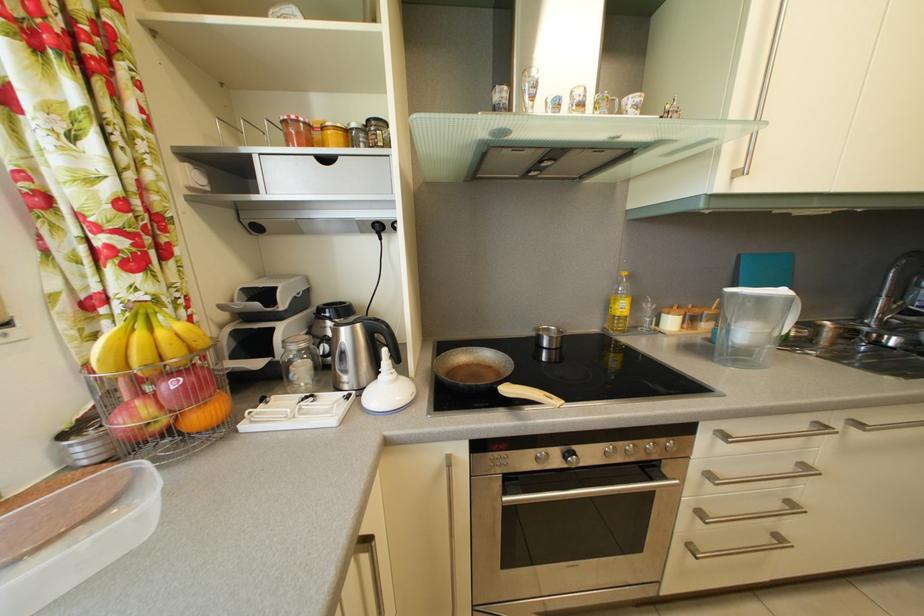
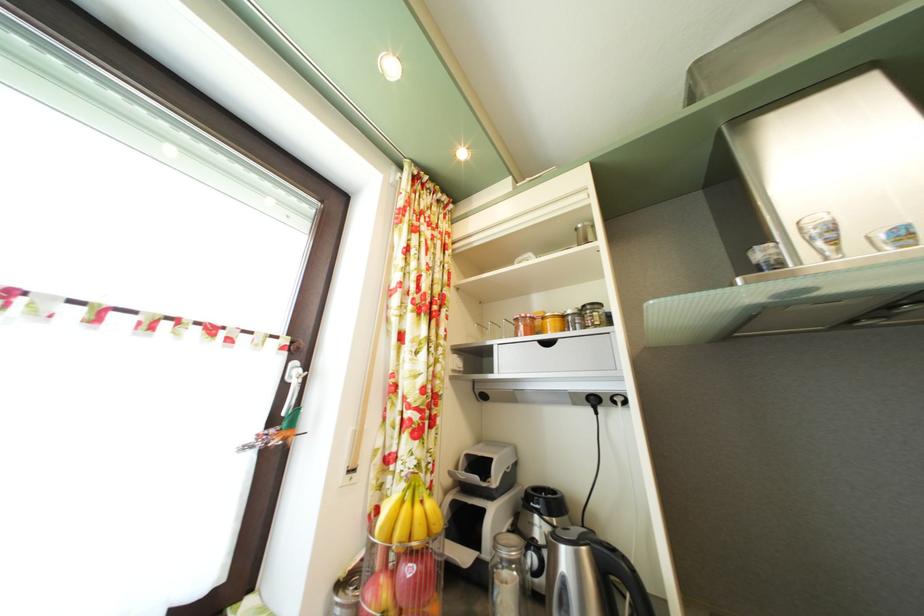
The point at (293, 130) is marked in the first image. Where is the corresponding point in the second image?

(525, 326)